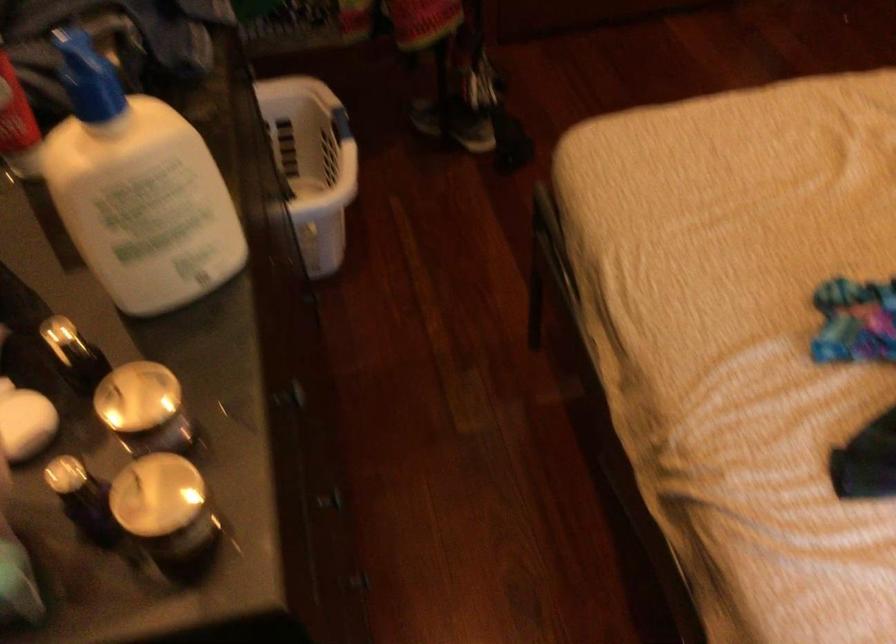
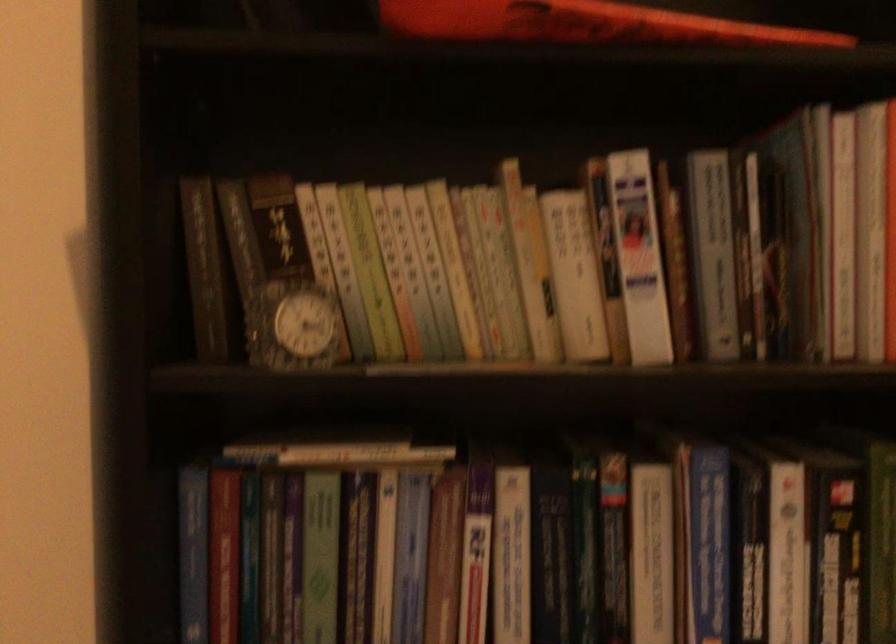
Question: The first image is from the beginning of the video and the second image is from the end. How did the camera likely rotate when shooting the video?

Choices:
 (A) Left
 (B) Right
 (C) Up
 (D) Down

Answer: (A)